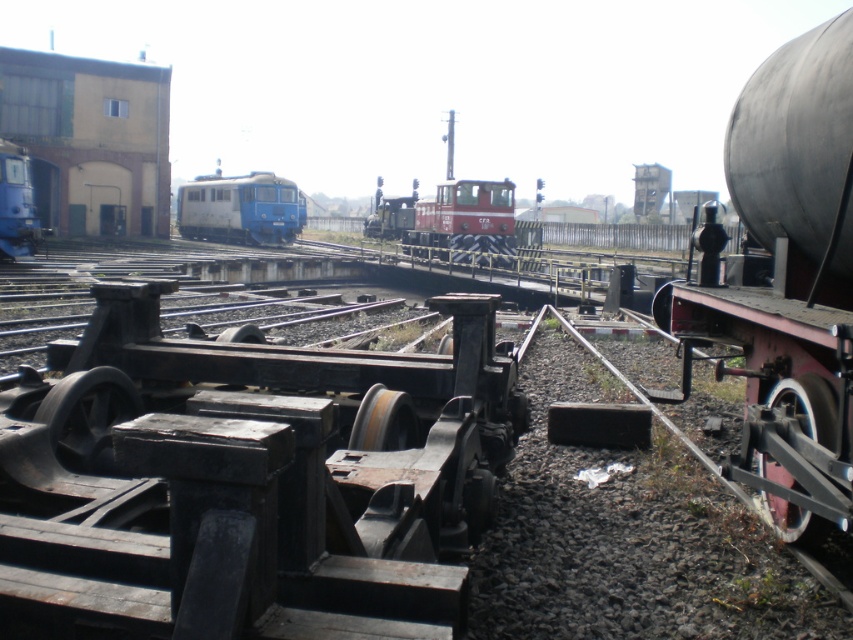
You are a railway inspector checking the tracks. You see the smooth black tank car at right and the blue matte train at center. Which one has a narrower width?

The smooth black tank car at right is thinner than the blue matte train at center, so the smooth black tank car at right has a narrower width.

Based on the photo, you are a railway inspector checking the tracks. You see the smooth black tank car at right and the red matte train at center. Which one is nearer to you?

The smooth black tank car at right is closer to the viewer than the red matte train at center.